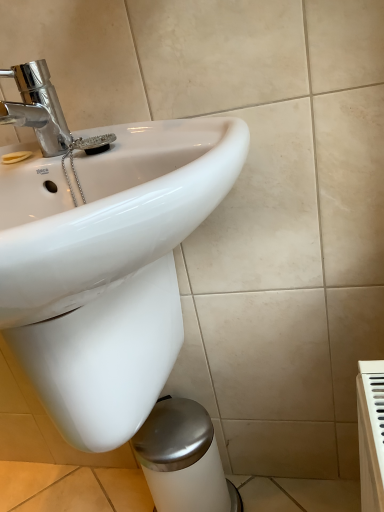
In order to click on white glossy sink at upper left in this screenshot , I will do `click(107, 266)`.

Image resolution: width=384 pixels, height=512 pixels. What do you see at coordinates (107, 266) in the screenshot? I see `white glossy sink at upper left` at bounding box center [107, 266].

Locate an element on the screen. white glossy sink at upper left is located at coordinates (107, 266).